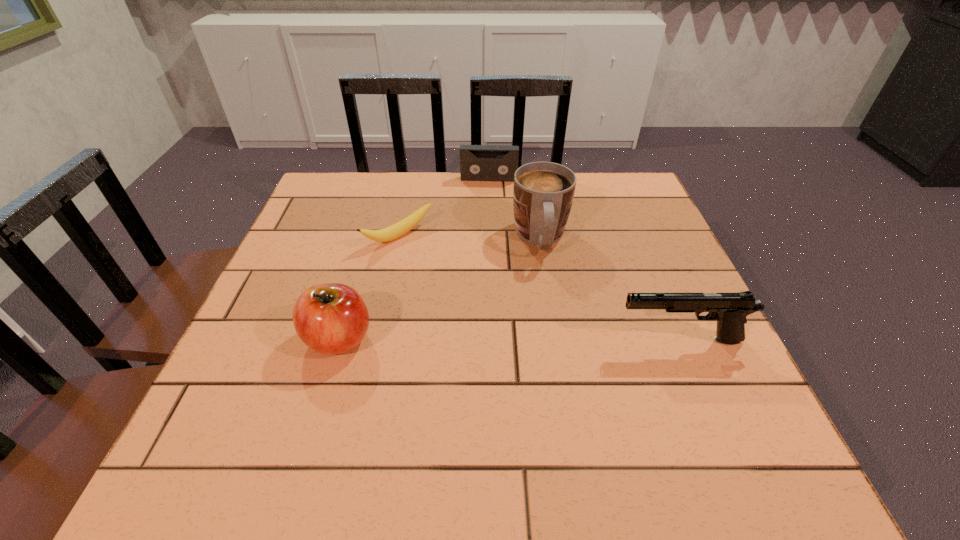
Where is `videotape that is at the far edge`? Image resolution: width=960 pixels, height=540 pixels. videotape that is at the far edge is located at coordinates (477, 162).

Locate an element on the screen. mug that is at the far edge is located at coordinates 543,192.

Where is `object that is at the left edge`? This screenshot has width=960, height=540. object that is at the left edge is located at coordinates (331, 318).

You are a GUI agent. You are given a task and a screenshot of the screen. Output one action in this format:
    pyautogui.click(x=<x>, y=<y>)
    Task: Click on the object at the right edge
    
    Given the screenshot: What is the action you would take?
    pyautogui.click(x=730, y=310)

You are a GUI agent. You are given a task and a screenshot of the screen. Output one action in this format:
    pyautogui.click(x=<x>, y=<y>)
    Task: Click on the vacant space at the far edge
    
    Given the screenshot: What is the action you would take?
    pyautogui.click(x=439, y=204)

Find the location of a particular element. free space at the near edge of the desktop is located at coordinates (622, 377).

Locate an element on the screen. free spot at the left edge of the desktop is located at coordinates (339, 245).

Find the location of a particular element. vacant space at the right edge of the desktop is located at coordinates (649, 357).

Where is `vacant space at the far left corner`? The height and width of the screenshot is (540, 960). vacant space at the far left corner is located at coordinates (315, 199).

Image resolution: width=960 pixels, height=540 pixels. Find the location of `free space at the near left corner`. free space at the near left corner is located at coordinates (245, 387).